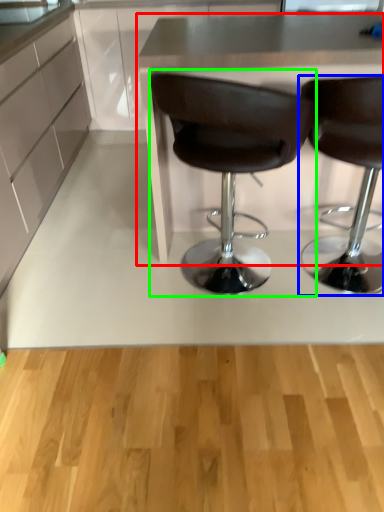
Question: Which object is the closest to the table (highlighted by a red box)? Choose among these: chair (highlighted by a blue box) or chair (highlighted by a green box).

Choices:
 (A) chair
 (B) chair

Answer: (B)